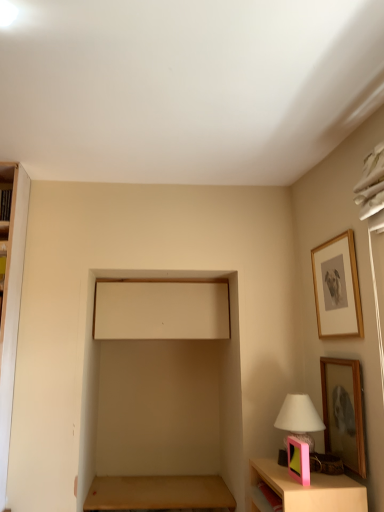
Question: Is pink plastic picture frame at lower right, the third picture frame when ordered from top to bottom, placed right next to wooden picture frame at lower right, positioned as the second picture frame in bottom-to-top order?

Choices:
 (A) yes
 (B) no

Answer: (B)

Question: Is pink plastic picture frame at lower right, the third picture frame when ordered from top to bottom, wider than wooden picture frame at lower right, the 2th picture frame positioned from the top?

Choices:
 (A) yes
 (B) no

Answer: (A)

Question: From the image's perspective, would you say pink plastic picture frame at lower right, which is the first picture frame in bottom-to-top order, is positioned over wooden picture frame at lower right, marked as the 2th picture frame in a left-to-right arrangement?

Choices:
 (A) yes
 (B) no

Answer: (B)

Question: Can you confirm if pink plastic picture frame at lower right, the third picture frame when ordered from top to bottom, is positioned to the left of wooden picture frame at lower right, the 2th picture frame positioned from the top?

Choices:
 (A) no
 (B) yes

Answer: (B)

Question: Is pink plastic picture frame at lower right, the third picture frame when ordered from top to bottom, bigger than wooden picture frame at lower right, positioned as the second picture frame in bottom-to-top order?

Choices:
 (A) no
 (B) yes

Answer: (A)

Question: Can you confirm if pink plastic picture frame at lower right, the third picture frame when ordered from top to bottom, is thinner than wooden picture frame at lower right, the second picture frame positioned from the right?

Choices:
 (A) yes
 (B) no

Answer: (B)

Question: Is brown wooden table at lower center completely or partially outside of pink plastic table lamp at lower right?

Choices:
 (A) no
 (B) yes

Answer: (B)

Question: From a real-world perspective, is brown wooden table at lower center located beneath pink plastic table lamp at lower right?

Choices:
 (A) no
 (B) yes

Answer: (B)

Question: Is brown wooden table at lower center smaller than pink plastic table lamp at lower right?

Choices:
 (A) no
 (B) yes

Answer: (A)

Question: Does brown wooden table at lower center have a greater height compared to pink plastic table lamp at lower right?

Choices:
 (A) yes
 (B) no

Answer: (B)

Question: Considering the relative sizes of brown wooden table at lower center and pink plastic table lamp at lower right in the image provided, is brown wooden table at lower center shorter than pink plastic table lamp at lower right?

Choices:
 (A) yes
 (B) no

Answer: (A)

Question: From the image's perspective, would you say brown wooden table at lower center is positioned over pink plastic table lamp at lower right?

Choices:
 (A) no
 (B) yes

Answer: (A)

Question: From the image's perspective, is wooden picture frame at lower right, positioned as the second picture frame in bottom-to-top order, above pink plastic table lamp at lower right?

Choices:
 (A) no
 (B) yes

Answer: (B)